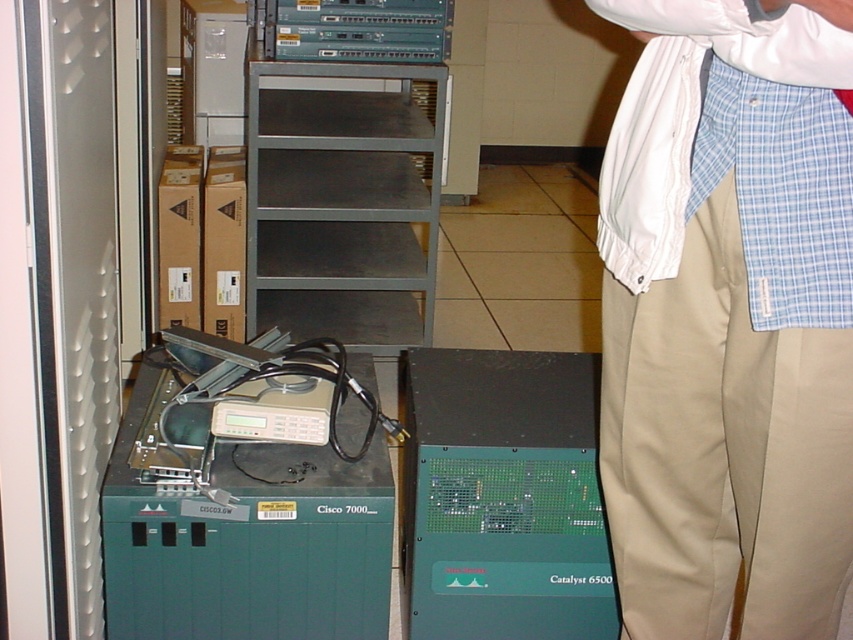
Between khaki cotton pants at lower right and green circuit board at center, which one appears on the left side from the viewer's perspective?

green circuit board at center

Is khaki cotton pants at lower right in front of green circuit board at center?

Yes.

Identify the location of khaki cotton pants at lower right. (728, 317).